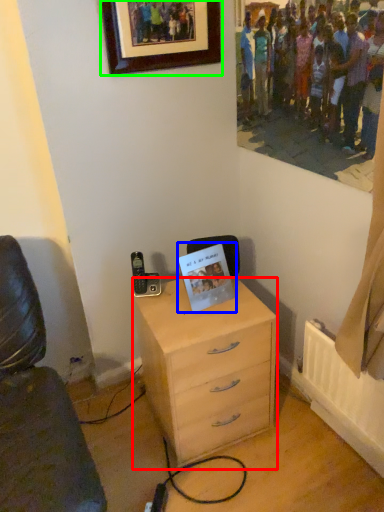
Question: Estimate the real-world distances between objects in this image. Which object is closer to chest of drawers (highlighted by a red box), postcard (highlighted by a blue box) or picture frame (highlighted by a green box)?

Choices:
 (A) postcard
 (B) picture frame

Answer: (A)